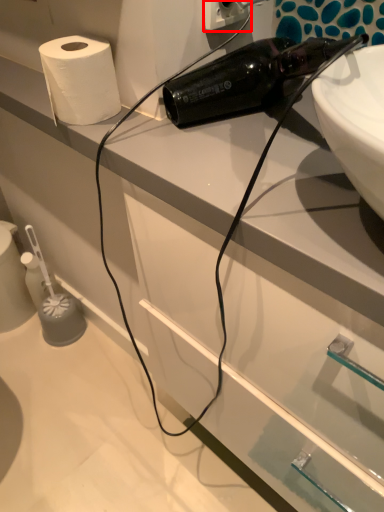
Question: From the image, what is the correct spatial relationship of electric outlet (annotated by the red box) in relation to paper towel?

Choices:
 (A) left
 (B) right

Answer: (B)